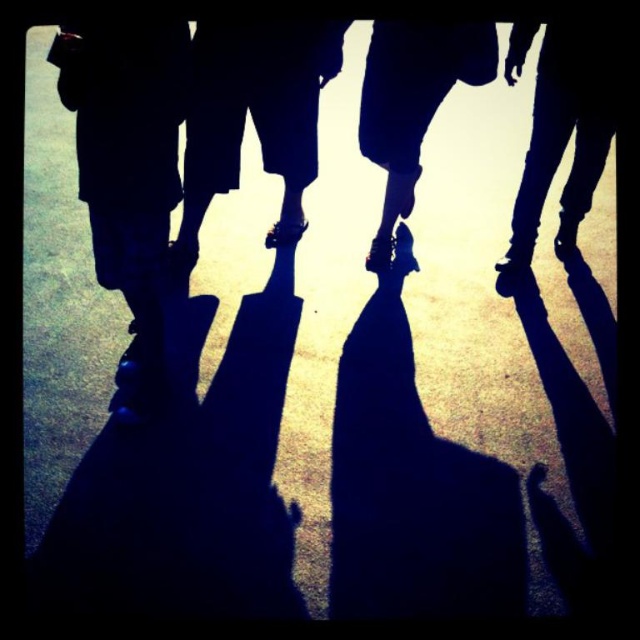
Question: Does matte black sandals at center appear on the right side of shiny black shoe at center?

Choices:
 (A) yes
 (B) no

Answer: (B)

Question: Which point is farther to the camera?

Choices:
 (A) (173, 129)
 (B) (182, 211)
 (C) (403, 58)
 (D) (552, 20)

Answer: (B)

Question: Is matte black sandals at center below leather boots at right?

Choices:
 (A) yes
 (B) no

Answer: (A)

Question: Can you confirm if leather boots at right is positioned to the left of shiny black shoe at center?

Choices:
 (A) yes
 (B) no

Answer: (B)

Question: Which of the following is the closest to the observer?

Choices:
 (A) (93, 257)
 (B) (284, 52)
 (C) (522, 35)
 (D) (397, 45)

Answer: (A)

Question: Among these points, which one is farthest from the camera?

Choices:
 (A) (538, 216)
 (B) (397, 154)
 (C) (67, 54)
 (D) (298, 220)

Answer: (D)